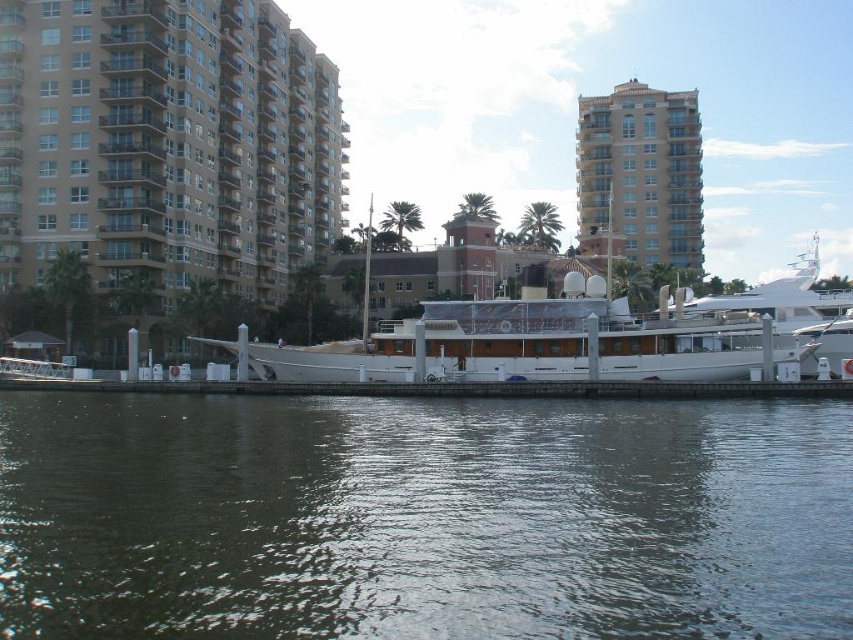
Question: Is greenish water at lower center positioned before white polished wood boat at center?

Choices:
 (A) yes
 (B) no

Answer: (A)

Question: Which is nearer to the greenish water at lower center?

Choices:
 (A) white polished wood boat at center
 (B) tan/brick-like building at upper right

Answer: (A)

Question: Does tan/brick-like building at upper right come in front of white glossy yacht at right?

Choices:
 (A) yes
 (B) no

Answer: (B)

Question: Which is farther from the white polished wood boat at center?

Choices:
 (A) white glossy yacht at right
 (B) tan/brick-like building at upper right

Answer: (B)

Question: Considering the relative positions of greenish water at lower center and beige concrete building at left in the image provided, where is greenish water at lower center located with respect to beige concrete building at left?

Choices:
 (A) above
 (B) below

Answer: (B)

Question: Which of the following is the closest to the observer?

Choices:
 (A) (28, 179)
 (B) (628, 250)
 (C) (758, 312)

Answer: (C)